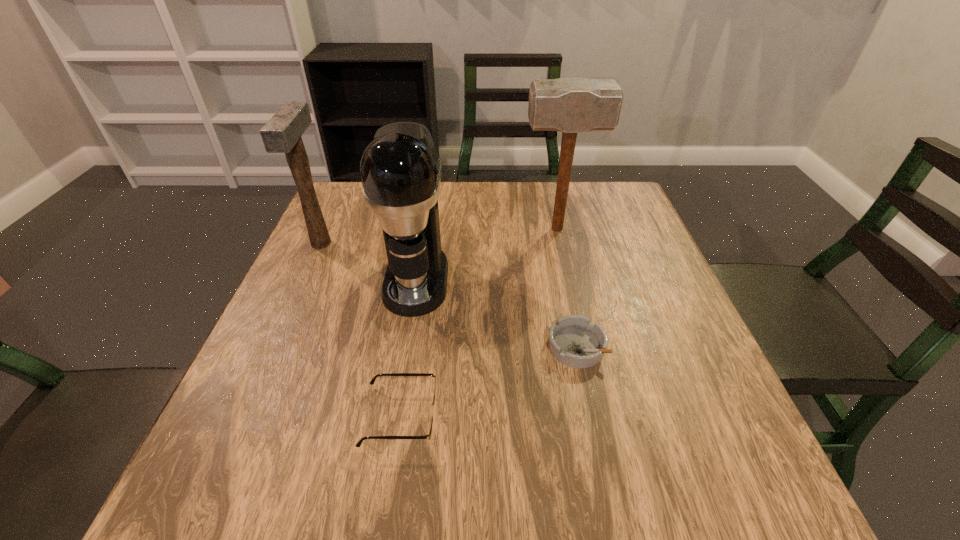
What are the coordinates of `the right mallet` in the screenshot? It's located at (569, 105).

The image size is (960, 540). I want to click on coffee maker, so click(400, 170).

This screenshot has height=540, width=960. In order to click on the leftmost object in this screenshot , I will do `click(282, 133)`.

Locate an element on the screen. The width and height of the screenshot is (960, 540). the nearest object is located at coordinates (433, 404).

I want to click on the second nearest object, so click(575, 342).

I want to click on free location located on the striking face of the right mallet, so click(x=472, y=229).

Locate an element on the screen. The width and height of the screenshot is (960, 540). blank space located 0.360m on the striking face of the right mallet is located at coordinates (386, 229).

This screenshot has width=960, height=540. I want to click on vacant space located 0.120m on the striking face of the right mallet, so click(x=476, y=229).

Image resolution: width=960 pixels, height=540 pixels. Find the location of `vacant space situated place cup under the spout of the coffee maker`. vacant space situated place cup under the spout of the coffee maker is located at coordinates (400, 380).

Find the location of a particular element. This screenshot has width=960, height=540. free space located 0.080m on the back of the left mallet is located at coordinates (336, 210).